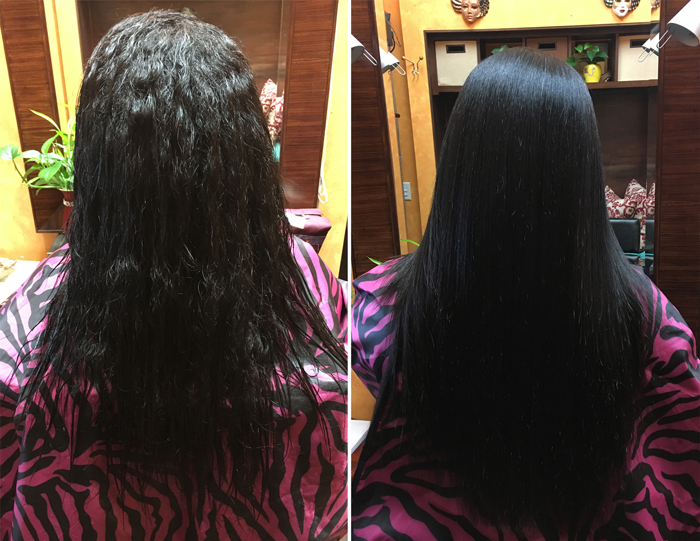
The width and height of the screenshot is (700, 541). What are the coordinates of `power cord` in the screenshot? It's located at (322, 190).